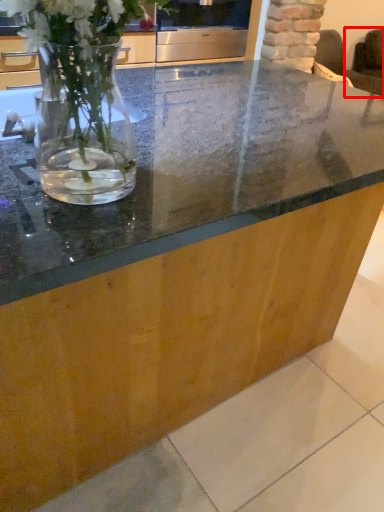
Question: From the image's perspective, where is armchair (annotated by the red box) located in relation to appliance in the image?

Choices:
 (A) below
 (B) above

Answer: (B)